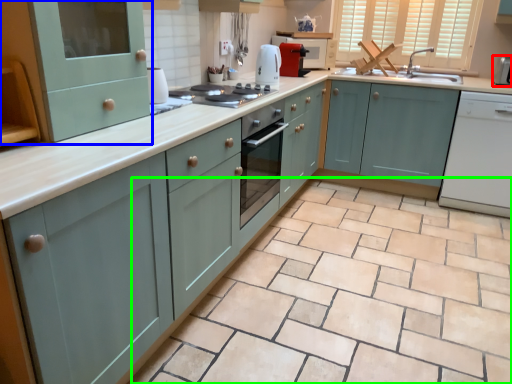
Question: Which object is positioned closest to appliance (highlighted by a red box)? Select from cabinetry (highlighted by a blue box) and ceramic tile (highlighted by a green box).

Choices:
 (A) cabinetry
 (B) ceramic tile

Answer: (B)